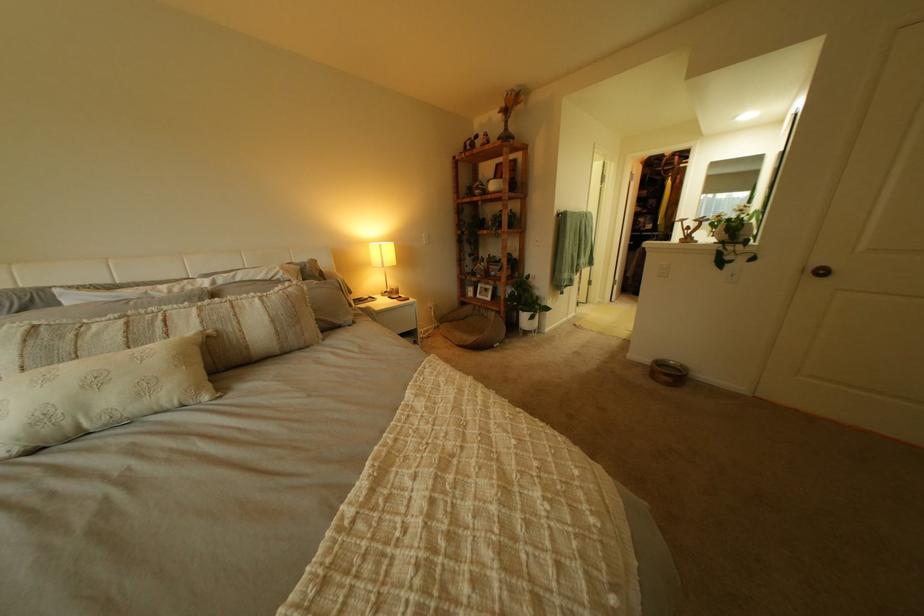
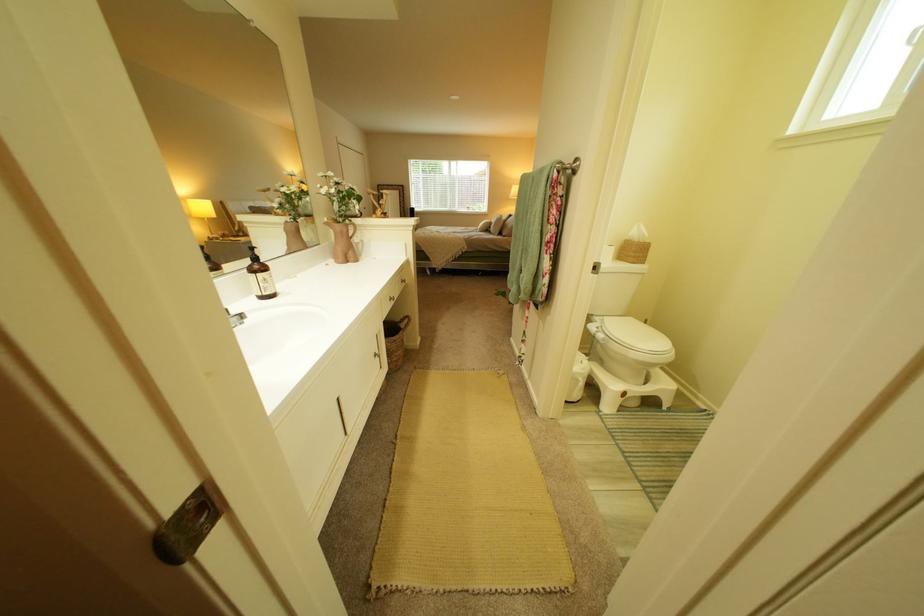
Question: I am providing you with two images of the same scene from different viewpoints. After the viewpoint changes to image2, which objects are now occluded?

Choices:
 (A) white step stool
 (B) black marker
 (C) grey pillow
 (D) white plant pot

Answer: (D)